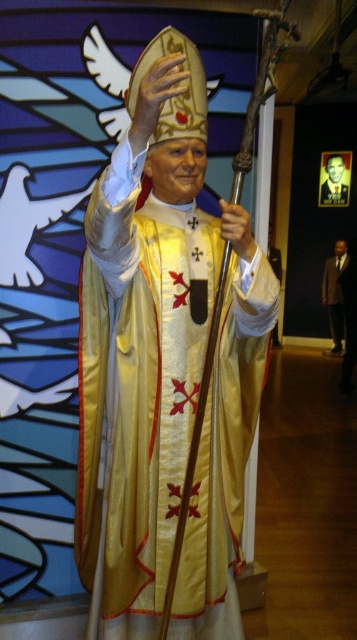
Between point (343, 246) and point (249, 244), which one is positioned in front?

Point (249, 244)

Does dark brown suit at right have a greater height compared to white matte hand at center?

Correct, dark brown suit at right is much taller as white matte hand at center.

What do you see at coordinates (334, 292) in the screenshot? The height and width of the screenshot is (640, 357). I see `dark brown suit at right` at bounding box center [334, 292].

This screenshot has width=357, height=640. Find the location of `dark brown suit at right`. dark brown suit at right is located at coordinates (334, 292).

Between smooth gold hand at upper center and gold textured robe at center, which one has more height?

gold textured robe at center is taller.

Can you confirm if smooth gold hand at upper center is wider than gold textured robe at center?

In fact, smooth gold hand at upper center might be narrower than gold textured robe at center.

The height and width of the screenshot is (640, 357). Identify the location of smooth gold hand at upper center. (156, 96).

At what (x,y) coordinates should I click in order to perform the action: click on smooth gold hand at upper center. Please return your answer as a coordinate pair (x, y). Image resolution: width=357 pixels, height=640 pixels. Looking at the image, I should click on (156, 96).

Is dark brown suit at right behind gold textured robe at center?

No, it is in front of gold textured robe at center.

Does dark brown suit at right lie in front of gold textured robe at center?

Yes, dark brown suit at right is in front of gold textured robe at center.

Which is in front, point (344, 243) or point (329, 196)?

Point (344, 243) is in front.

Locate an element on the screen. dark brown suit at right is located at coordinates (334, 292).